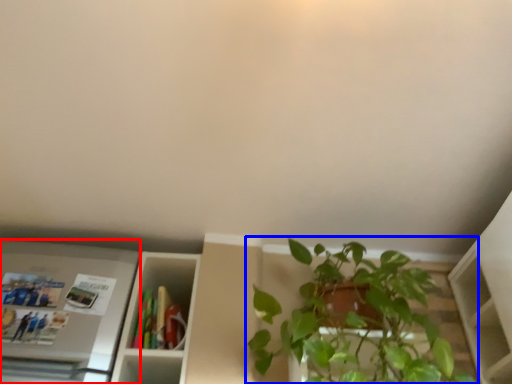
Question: Which of the following is the closest to the observer, appliance (highlighted by a red box) or houseplant (highlighted by a blue box)?

Choices:
 (A) appliance
 (B) houseplant

Answer: (B)